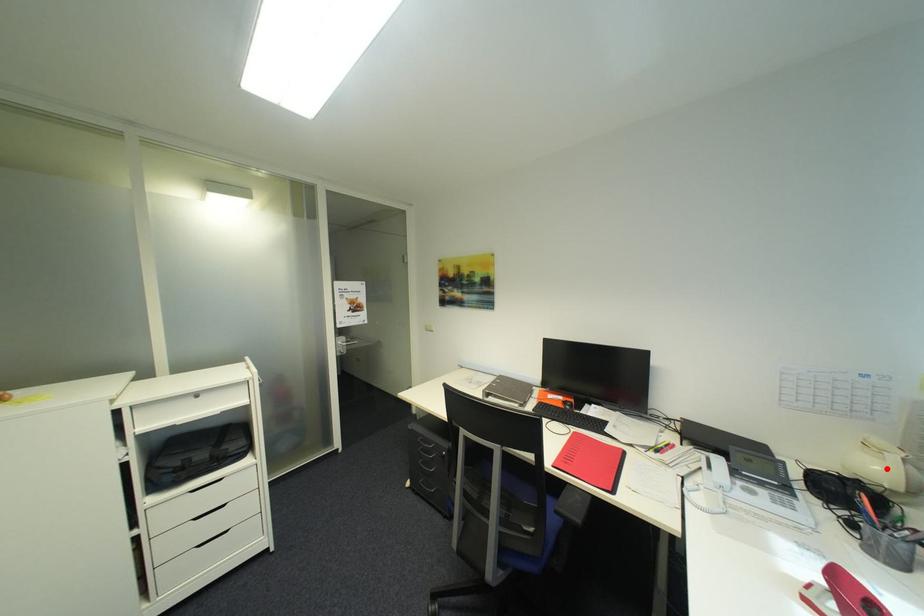
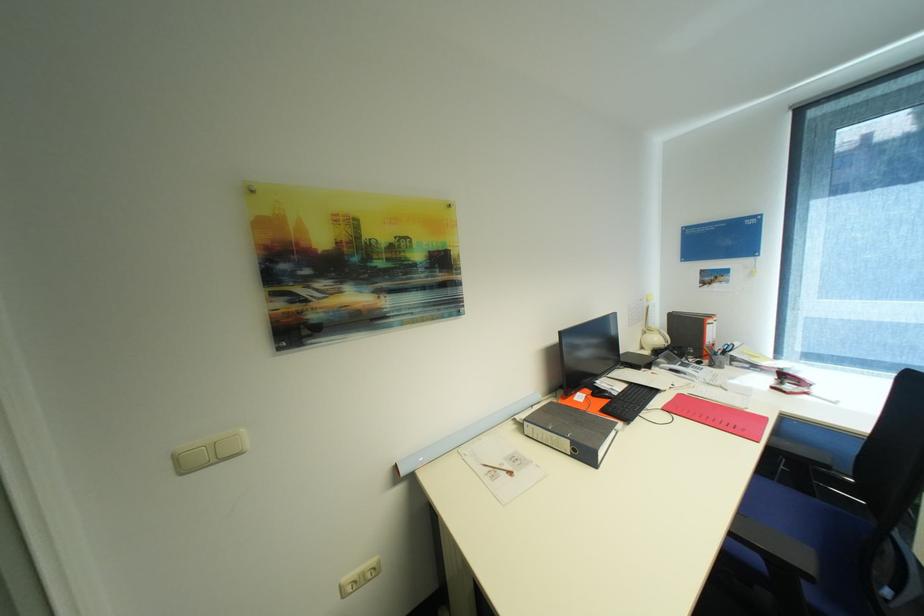
Question: A red point is marked in image1. In image2, is the corresponding 3D point closer to the camera or farther? Reply with the corresponding letter.

Choices:
 (A) The corresponding 3D point is closer.
 (B) The corresponding 3D point is farther.

Answer: (B)